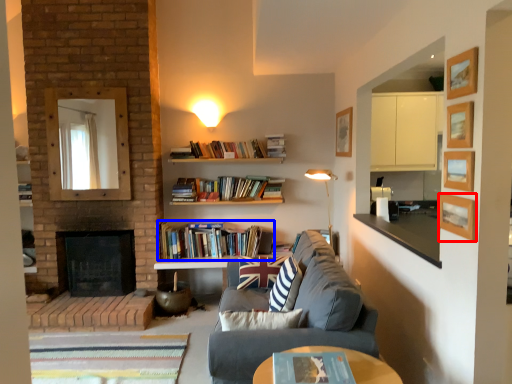
Question: Which of the following is the closest to the observer, picture frame (highlighted by a red box) or book (highlighted by a blue box)?

Choices:
 (A) picture frame
 (B) book

Answer: (A)